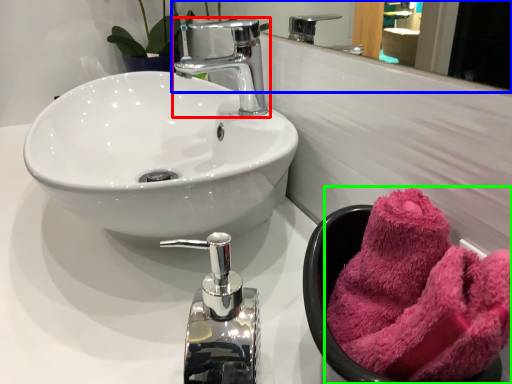
Question: Which is farther away from tap (highlighted by a red box)? mirror (highlighted by a blue box) or towel/napkin (highlighted by a green box)?

Choices:
 (A) mirror
 (B) towel/napkin

Answer: (A)